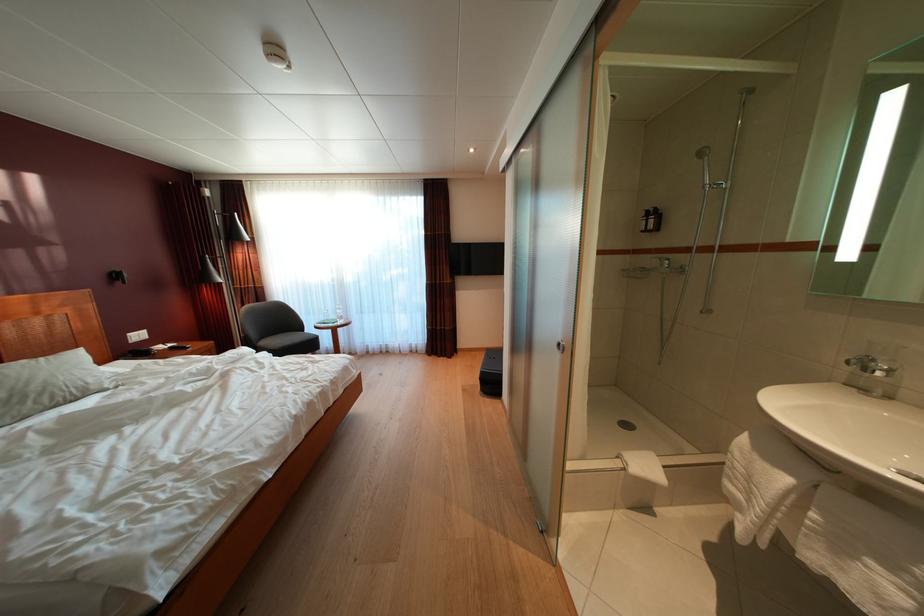
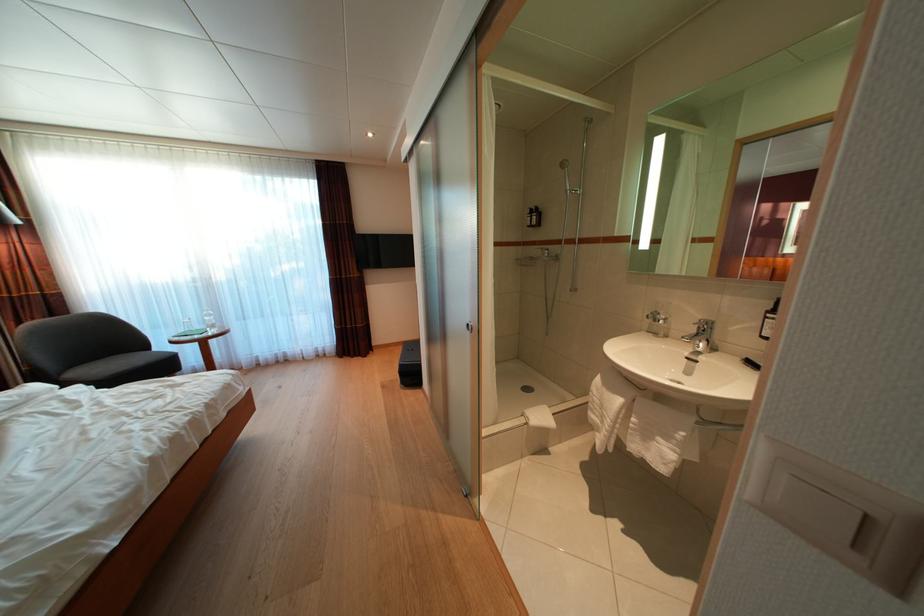
Question: The camera is either moving clockwise (left) or counter-clockwise (right) around the object. The first image is from the beginning of the video and the second image is from the end. Is the camera moving left or right when shooting the video?

Choices:
 (A) Left
 (B) Right

Answer: (A)